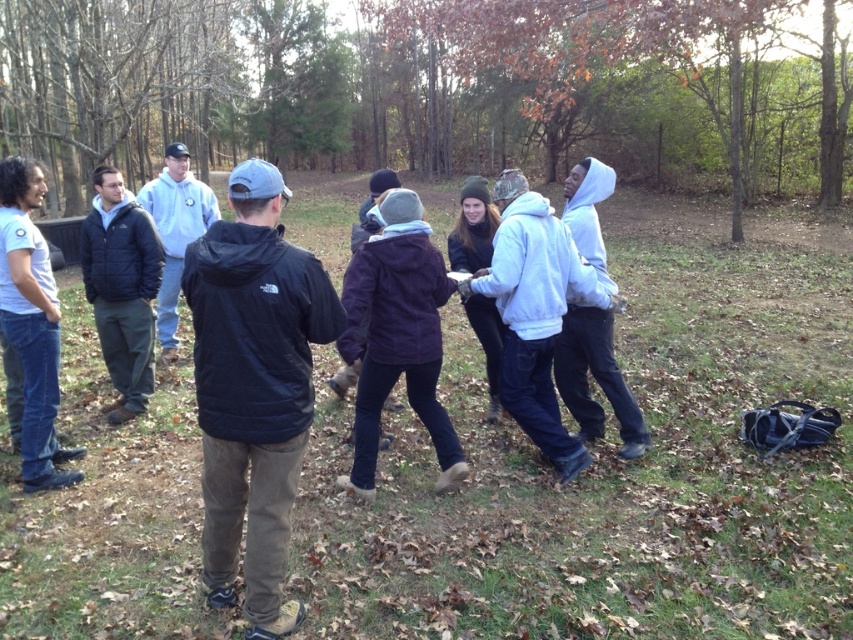
Is black matte jacket at center positioned before white matte t-shirt at left?

Yes, it is.

Who is more forward, (248,422) or (45,301)?

Point (248,422) is more forward.

Identify the location of black matte jacket at center. (254, 388).

Which is above, white fleece hoodie at center or white fleece hoodie at right?

Positioned higher is white fleece hoodie at right.

Does white fleece hoodie at center appear on the right side of white fleece hoodie at right?

In fact, white fleece hoodie at center is to the left of white fleece hoodie at right.

Who is more distant from viewer, (x=573, y=266) or (x=616, y=380)?

Point (x=616, y=380)

What are the coordinates of `white fleece hoodie at center` in the screenshot? It's located at (535, 310).

Which is in front, point (535, 237) or point (115, 196)?

Point (535, 237)

In the scene shown: Who is shorter, white fleece hoodie at center or dark blue jacket at left?

With less height is white fleece hoodie at center.

You are a GUI agent. You are given a task and a screenshot of the screen. Output one action in this format:
    pyautogui.click(x=<x>, y=<y>)
    Task: Click on the white fleece hoodie at center
    The height and width of the screenshot is (640, 853).
    Given the screenshot: What is the action you would take?
    pyautogui.click(x=535, y=310)